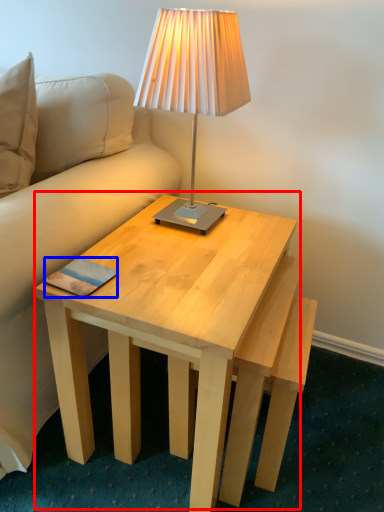
Question: Among these objects, which one is farthest to the camera, coffee table (highlighted by a red box) or pad (highlighted by a blue box)?

Choices:
 (A) coffee table
 (B) pad

Answer: (B)